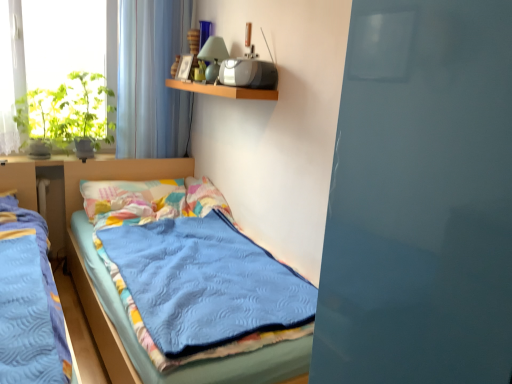
Question: Should I look upward or downward to see blue quilted bed at center?

Choices:
 (A) up
 (B) down

Answer: (B)

Question: Does wooden shelf at upper center have a greater height compared to multicolored fabric pillow at center?

Choices:
 (A) yes
 (B) no

Answer: (B)

Question: Does wooden shelf at upper center have a lesser width compared to multicolored fabric pillow at center?

Choices:
 (A) yes
 (B) no

Answer: (A)

Question: From the image's perspective, is wooden shelf at upper center under multicolored fabric pillow at center?

Choices:
 (A) yes
 (B) no

Answer: (B)

Question: Is the depth of wooden shelf at upper center less than that of multicolored fabric pillow at center?

Choices:
 (A) yes
 (B) no

Answer: (A)

Question: Is wooden shelf at upper center directly adjacent to multicolored fabric pillow at center?

Choices:
 (A) no
 (B) yes

Answer: (A)

Question: Is wooden shelf at upper center to the left of multicolored fabric pillow at center from the viewer's perspective?

Choices:
 (A) yes
 (B) no

Answer: (B)

Question: From the image's perspective, would you say translucent fabric curtain at upper left is shown under multicolored fabric pillow at center?

Choices:
 (A) no
 (B) yes

Answer: (A)

Question: Is translucent fabric curtain at upper left surrounding multicolored fabric pillow at center?

Choices:
 (A) yes
 (B) no

Answer: (B)

Question: Considering the relative sizes of translucent fabric curtain at upper left and multicolored fabric pillow at center in the image provided, is translucent fabric curtain at upper left bigger than multicolored fabric pillow at center?

Choices:
 (A) yes
 (B) no

Answer: (B)

Question: From a real-world perspective, is translucent fabric curtain at upper left under multicolored fabric pillow at center?

Choices:
 (A) yes
 (B) no

Answer: (B)

Question: Is translucent fabric curtain at upper left positioned beyond the bounds of multicolored fabric pillow at center?

Choices:
 (A) yes
 (B) no

Answer: (A)

Question: From the image's perspective, is translucent fabric curtain at upper left above multicolored fabric pillow at center?

Choices:
 (A) yes
 (B) no

Answer: (A)

Question: Does green leafy plant at left, the first plant viewed from the right, come in front of multicolored fabric pillow at center?

Choices:
 (A) yes
 (B) no

Answer: (B)